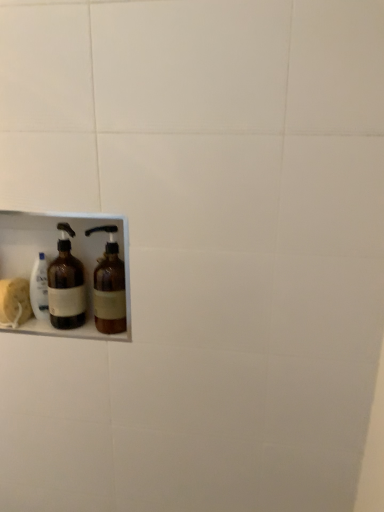
What do you see at coordinates (66, 288) in the screenshot?
I see `brown glass bottle at left, the 2th bottle positioned from the right` at bounding box center [66, 288].

The image size is (384, 512). In order to click on brown glass bottle at left, the first bottle from the left in this screenshot , I will do click(66, 288).

The height and width of the screenshot is (512, 384). What do you see at coordinates (109, 285) in the screenshot? I see `brown glass bottle at lower left, which ranks as the first bottle in right-to-left order` at bounding box center [109, 285].

The height and width of the screenshot is (512, 384). What are the coordinates of `brown glass bottle at lower left, the 2th bottle positioned from the left` in the screenshot? It's located at (109, 285).

Find the location of `brown glass bottle at left, the first bottle from the left`. brown glass bottle at left, the first bottle from the left is located at coordinates (66, 288).

Which is more to the left, brown glass bottle at lower left, the 2th bottle positioned from the left, or brown glass bottle at left, the first bottle from the left?

brown glass bottle at left, the first bottle from the left, is more to the left.

In the image, is brown glass bottle at lower left, which ranks as the first bottle in right-to-left order, positioned in front of or behind brown glass bottle at left, the first bottle from the left?

brown glass bottle at lower left, which ranks as the first bottle in right-to-left order, is in front of brown glass bottle at left, the first bottle from the left.

Considering the positions of point (108, 227) and point (63, 293), is point (108, 227) closer or farther from the camera than point (63, 293)?

Point (108, 227) is farther from the camera than point (63, 293).

From the image's perspective, which is below, brown glass bottle at lower left, which ranks as the first bottle in right-to-left order, or brown glass bottle at left, the first bottle from the left?

From the image's view, brown glass bottle at lower left, which ranks as the first bottle in right-to-left order, is below.

From a real-world perspective, which object stands above the other?

brown glass bottle at lower left, the 2th bottle positioned from the left, is physically above.

Does brown glass bottle at lower left, which ranks as the first bottle in right-to-left order, have a greater width compared to brown glass bottle at left, the 2th bottle positioned from the right?

Yes.

Considering the sizes of objects brown glass bottle at lower left, which ranks as the first bottle in right-to-left order, and brown glass bottle at left, the 2th bottle positioned from the right, in the image provided, who is shorter, brown glass bottle at lower left, which ranks as the first bottle in right-to-left order, or brown glass bottle at left, the 2th bottle positioned from the right,?

brown glass bottle at lower left, which ranks as the first bottle in right-to-left order, is shorter.

Based on the photo, considering the sizes of brown glass bottle at lower left, which ranks as the first bottle in right-to-left order, and brown glass bottle at left, the 2th bottle positioned from the right, in the image, is brown glass bottle at lower left, which ranks as the first bottle in right-to-left order, bigger or smaller than brown glass bottle at left, the 2th bottle positioned from the right,?

Considering their sizes, brown glass bottle at lower left, which ranks as the first bottle in right-to-left order, takes up more space than brown glass bottle at left, the 2th bottle positioned from the right.

Is brown glass bottle at lower left, the 2th bottle positioned from the left, outside of brown glass bottle at left, the first bottle from the left?

Yes.

Is brown glass bottle at lower left, which ranks as the first bottle in right-to-left order, with brown glass bottle at left, the first bottle from the left?

Yes, brown glass bottle at lower left, which ranks as the first bottle in right-to-left order, is touching brown glass bottle at left, the first bottle from the left.

Consider the image. Is brown glass bottle at lower left, the 2th bottle positioned from the left, oriented away from brown glass bottle at left, the 2th bottle positioned from the right?

brown glass bottle at lower left, the 2th bottle positioned from the left, does not have its back to brown glass bottle at left, the 2th bottle positioned from the right.

How different are the orientations of brown glass bottle at lower left, the 2th bottle positioned from the left, and brown glass bottle at left, the first bottle from the left, in degrees?

0.000895 degrees separate the facing orientations of brown glass bottle at lower left, the 2th bottle positioned from the left, and brown glass bottle at left, the first bottle from the left.

Identify the location of bottle on the right of the brown glass bottle at left, the 2th bottle positioned from the right. (109, 285).

Is brown glass bottle at left, the first bottle from the left, to the right of brown glass bottle at lower left, which ranks as the first bottle in right-to-left order, from the viewer's perspective?

Incorrect, brown glass bottle at left, the first bottle from the left, is not on the right side of brown glass bottle at lower left, which ranks as the first bottle in right-to-left order.

Is brown glass bottle at left, the 2th bottle positioned from the right, behind brown glass bottle at lower left, which ranks as the first bottle in right-to-left order?

Yes.

Does point (82, 273) come in front of point (116, 298)?

No, it is not.

From the image's perspective, is brown glass bottle at left, the first bottle from the left, beneath brown glass bottle at lower left, which ranks as the first bottle in right-to-left order?

No, from the image's perspective, brown glass bottle at left, the first bottle from the left, is not beneath brown glass bottle at lower left, which ranks as the first bottle in right-to-left order.

From a real-world perspective, is brown glass bottle at left, the first bottle from the left, physically above brown glass bottle at lower left, the 2th bottle positioned from the left?

No, from a real-world perspective, brown glass bottle at left, the first bottle from the left, is not over brown glass bottle at lower left, the 2th bottle positioned from the left

Considering the sizes of objects brown glass bottle at left, the first bottle from the left, and brown glass bottle at lower left, which ranks as the first bottle in right-to-left order, in the image provided, who is wider, brown glass bottle at left, the first bottle from the left, or brown glass bottle at lower left, which ranks as the first bottle in right-to-left order,?

Wider between the two is brown glass bottle at lower left, which ranks as the first bottle in right-to-left order.

In terms of height, does brown glass bottle at left, the first bottle from the left, look taller or shorter compared to brown glass bottle at lower left, the 2th bottle positioned from the left?

In the image, brown glass bottle at left, the first bottle from the left, appears to be taller than brown glass bottle at lower left, the 2th bottle positioned from the left.

Who is bigger, brown glass bottle at left, the 2th bottle positioned from the right, or brown glass bottle at lower left, which ranks as the first bottle in right-to-left order?

With larger size is brown glass bottle at lower left, which ranks as the first bottle in right-to-left order.

Does brown glass bottle at left, the 2th bottle positioned from the right, contain brown glass bottle at lower left, which ranks as the first bottle in right-to-left order?

No, brown glass bottle at left, the 2th bottle positioned from the right, does not contain brown glass bottle at lower left, which ranks as the first bottle in right-to-left order.

Is there a large distance between brown glass bottle at left, the first bottle from the left, and brown glass bottle at lower left, which ranks as the first bottle in right-to-left order?

brown glass bottle at left, the first bottle from the left, is actually quite close to brown glass bottle at lower left, which ranks as the first bottle in right-to-left order.

Could you tell me if brown glass bottle at left, the 2th bottle positioned from the right, is facing brown glass bottle at lower left, the 2th bottle positioned from the left?

No, brown glass bottle at left, the 2th bottle positioned from the right, does not turn towards brown glass bottle at lower left, the 2th bottle positioned from the left.

How different are the orientations of brown glass bottle at left, the 2th bottle positioned from the right, and brown glass bottle at lower left, which ranks as the first bottle in right-to-left order, in degrees?

The angle between the facing direction of brown glass bottle at left, the 2th bottle positioned from the right, and the facing direction of brown glass bottle at lower left, which ranks as the first bottle in right-to-left order, is 0.000895 degrees.

How far apart are brown glass bottle at left, the first bottle from the left, and brown glass bottle at lower left, the 2th bottle positioned from the left?

3.38 inches.

Locate an element on the screen. The image size is (384, 512). bottle positioned vertically above the brown glass bottle at left, the first bottle from the left (from a real-world perspective) is located at coordinates (109, 285).

Where is `bottle on the left side of brown glass bottle at lower left, which ranks as the first bottle in right-to-left order`? bottle on the left side of brown glass bottle at lower left, which ranks as the first bottle in right-to-left order is located at coordinates (66, 288).

Image resolution: width=384 pixels, height=512 pixels. I want to click on bottle behind the brown glass bottle at lower left, the 2th bottle positioned from the left, so click(x=66, y=288).